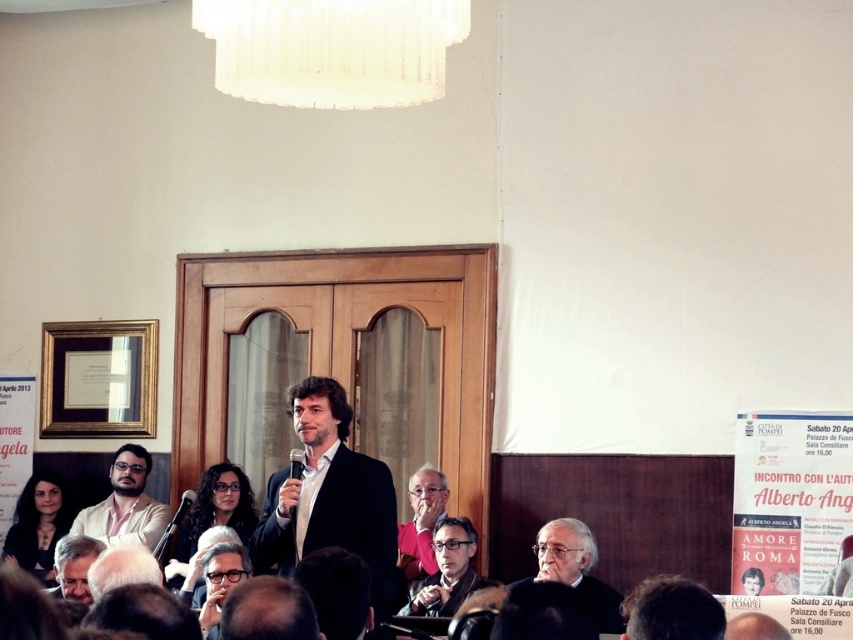
Question: Which of the following is the closest to the observer?

Choices:
 (A) matte black jacket at center
 (B) matte black glasses at center
 (C) gray hair at lower left

Answer: (C)

Question: Does matte black glasses at center come behind gray hair at lower left?

Choices:
 (A) no
 (B) yes

Answer: (B)

Question: Which object is positioned closest to the black textured suit at lower right?

Choices:
 (A) matte black jacket at center
 (B) matte black suit at center
 (C) dark hair at lower left
 (D) matte white shirt at lower left

Answer: (A)

Question: Does black textured suit at lower right appear under pink fabric at center?

Choices:
 (A) no
 (B) yes

Answer: (B)

Question: Does black textured suit at lower right have a larger size compared to dark hair at lower left?

Choices:
 (A) yes
 (B) no

Answer: (B)

Question: Which point appears farthest from the camera in this image?

Choices:
 (A) (90, 545)
 (B) (532, 579)
 (C) (225, 493)
 (D) (41, 496)

Answer: (D)